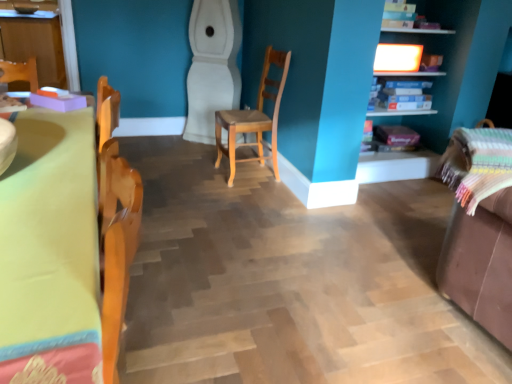
Question: Is matte wooden shelf at upper right, which is the first shelf from top to bottom, wider or thinner than wooden chair at center?

Choices:
 (A) wide
 (B) thin

Answer: (A)

Question: Is point (456, 92) positioned closer to the camera than point (257, 139)?

Choices:
 (A) closer
 (B) farther

Answer: (A)

Question: Which object is the farthest from the yellow fabric table at left?

Choices:
 (A) matte wood cabinet at upper left
 (B) brown leather swivel chair at right
 (C) wooden chair at center
 (D) matte wooden shelf at upper right, which is the first shelf from top to bottom
 (E) blue cardboard boxes at upper right, which appears as the 1th shelf when ordered from the bottom

Answer: (A)

Question: Estimate the real-world distances between objects in this image. Which object is closer to the matte wood cabinet at upper left?

Choices:
 (A) brown leather swivel chair at right
 (B) matte wooden shelf at upper right, which is counted as the 2th shelf, starting from the bottom
 (C) wooden chair at center
 (D) yellow fabric table at left
 (E) blue cardboard boxes at upper right, which appears as the 2th shelf when viewed from the top

Answer: (C)